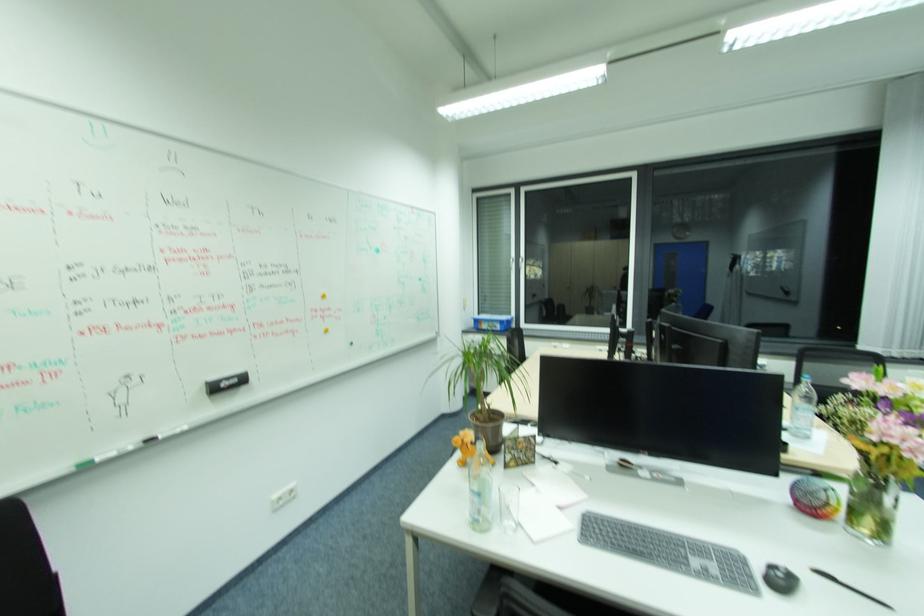
The width and height of the screenshot is (924, 616). What do you see at coordinates (703, 342) in the screenshot?
I see `the chair sitting surface` at bounding box center [703, 342].